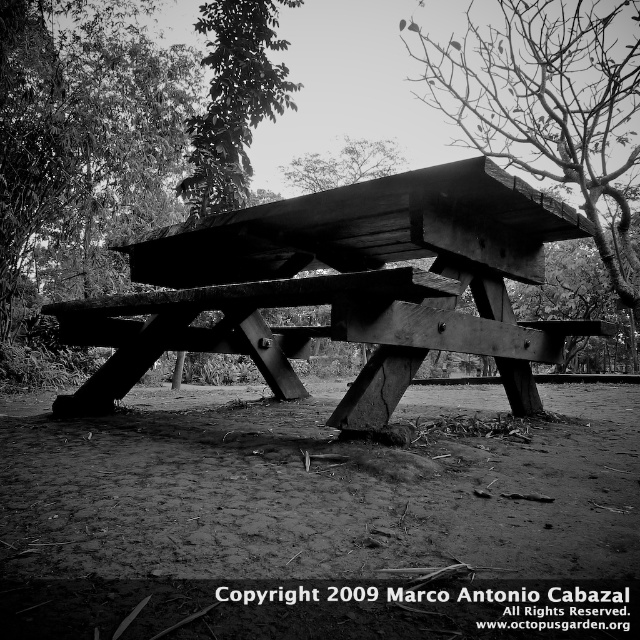
You are standing at the picnic table and want to pick up an item located at one of the two points. Which point, point [557,397] or point [212,173], is closer to you?

Point [557,397] is closer to the viewer than point [212,173], so you should pick up the item at point [557,397] first since it is nearer to you.

Based on the photo, you are standing at the picnic table and want to place a small item at the point labeled point (456, 67) and another item at point (241, 156). Which point is closer to you?

Point (241, 156) is closer to you because point (456, 67) is behind it.

You are an artist sketching the scene and need to decide which tree to focus on first based on their sizes. Which tree at upper center has a greater width, the bare wood tree at upper center or the green leafy tree at upper center?

The bare wood tree at upper center has a greater width than the green leafy tree at upper center according to the description.